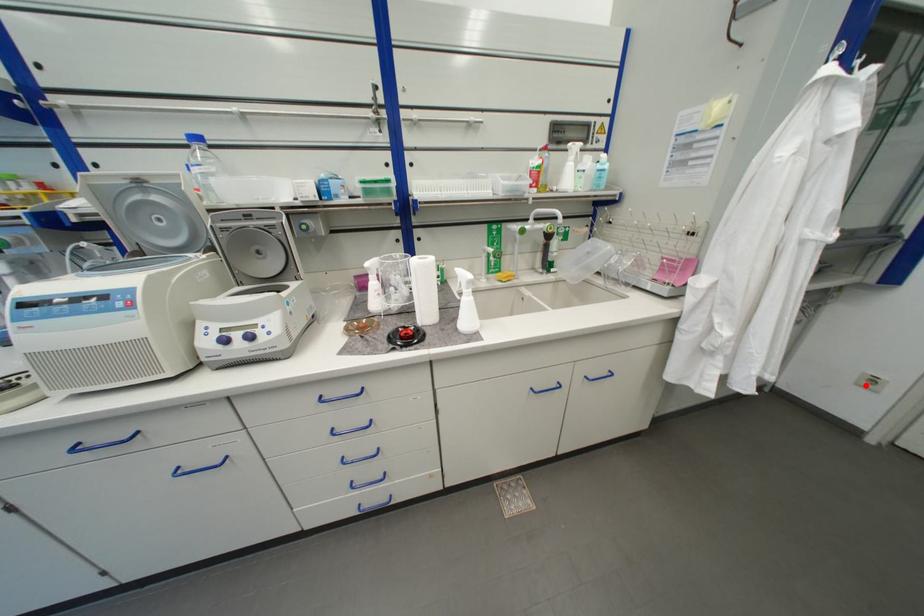
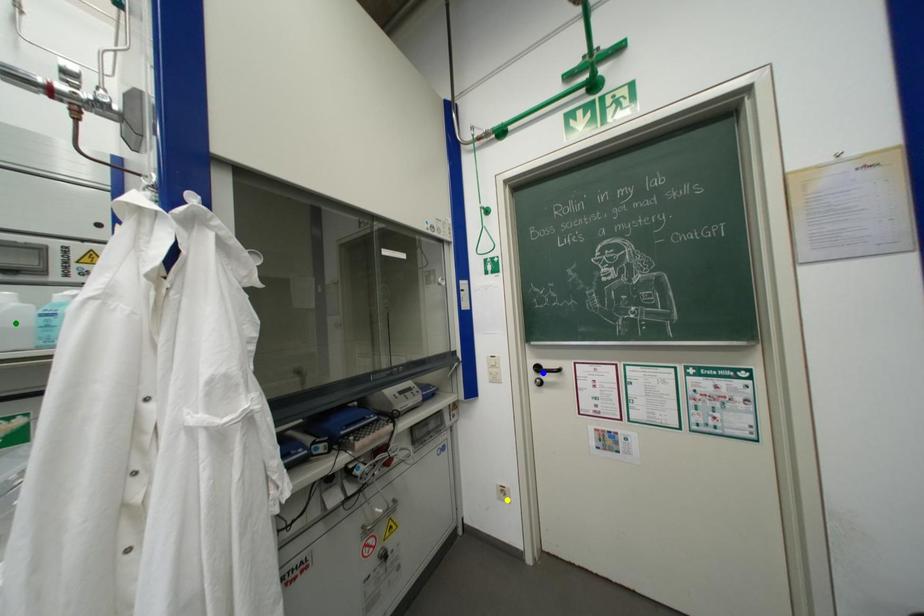
Question: I am providing you with two images of the same scene from different viewpoints. A red point is marked on the first image. You are given multiple points on the second image. Which spot in image 2 lines up with the point in image 1?

Choices:
 (A) green point
 (B) blue point
 (C) yellow point

Answer: (C)